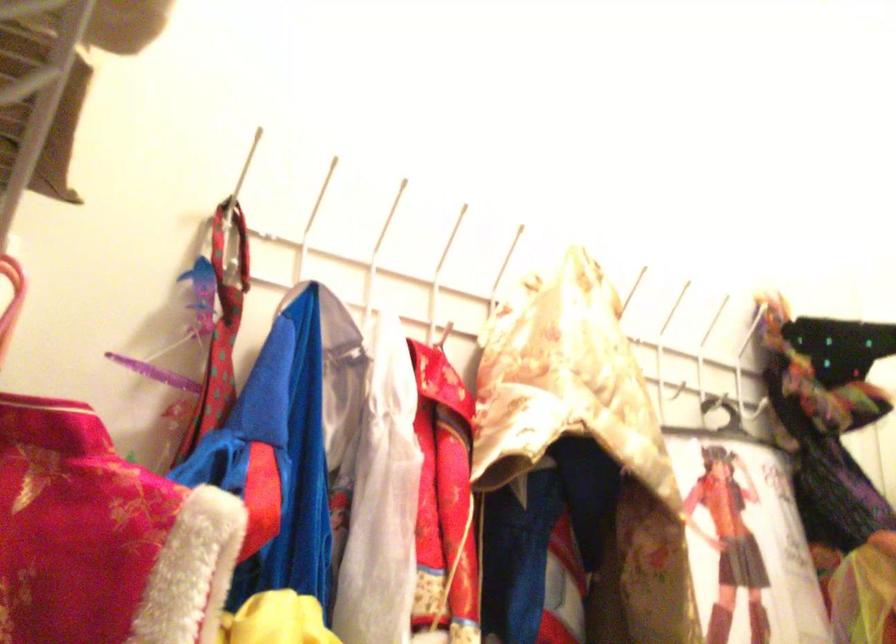
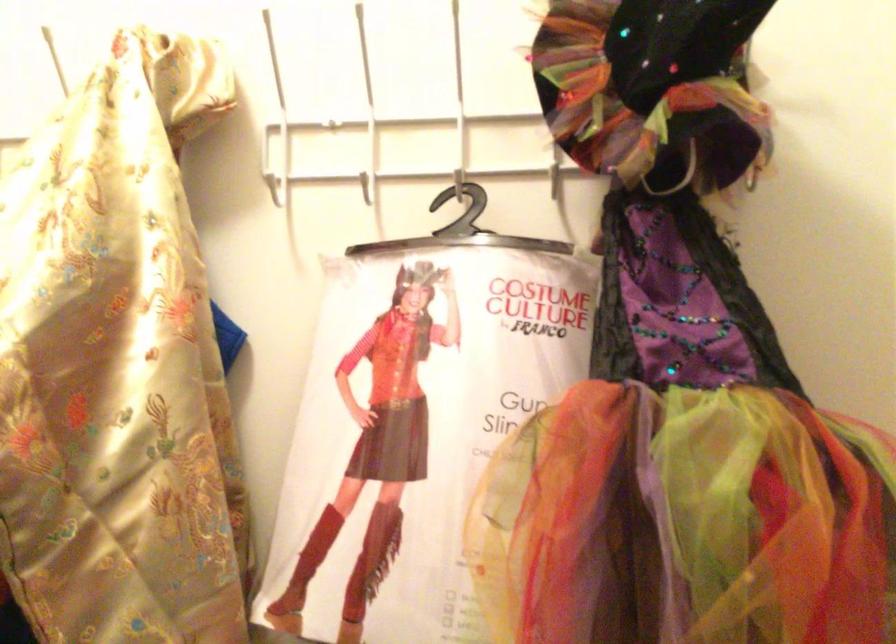
Where in the second image is the point corresponding to point (728, 421) from the first image?

(461, 230)